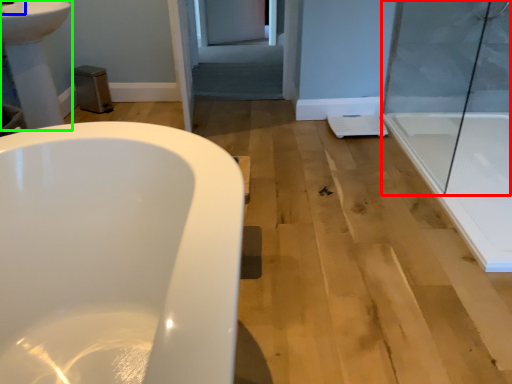
Question: Which is farther away from shower door (highlighted by a red box)? faucet (highlighted by a blue box) or sink (highlighted by a green box)?

Choices:
 (A) faucet
 (B) sink

Answer: (A)